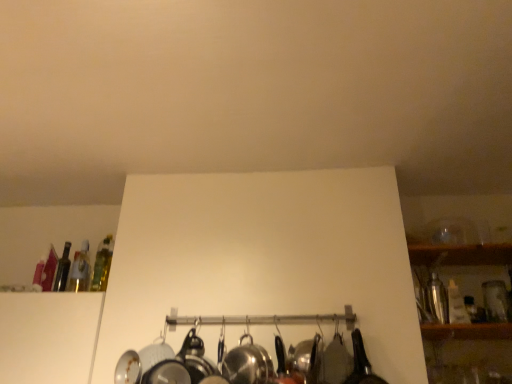
Where is `polished stainless steel wok at center`? The width and height of the screenshot is (512, 384). polished stainless steel wok at center is located at coordinates (247, 363).

How much space does translucent glass bottle at left, which appears as the 3th bottle when viewed from the left, occupy vertically?

It is 31.62 centimeters.

The height and width of the screenshot is (384, 512). Find the location of `polished stainless steel wok at center`. polished stainless steel wok at center is located at coordinates (247, 363).

Find the location of a particular element. The image size is (512, 384). the 2nd bottle below the translucent glass bottle at upper left, which is counted as the fourth bottle, starting from the right (from the image's perspective) is located at coordinates (437, 299).

Is translucent glass bottle at upper left, which is counted as the fourth bottle, starting from the right, completely or partially inside shiny metallic shaker at right, the 4th bottle from the left?

No, translucent glass bottle at upper left, which is counted as the fourth bottle, starting from the right, is not a part of shiny metallic shaker at right, the 4th bottle from the left.

How many degrees apart are the facing directions of shiny metallic shaker at right, arranged as the first bottle when viewed from the right, and translucent glass bottle at upper left, which is counted as the fourth bottle, starting from the right?

shiny metallic shaker at right, arranged as the first bottle when viewed from the right, and translucent glass bottle at upper left, which is counted as the fourth bottle, starting from the right, are facing 0.0034 degrees away from each other.

Is polished stainless steel wok at center directly adjacent to shiny metallic shaker at right, arranged as the first bottle when viewed from the right?

No, polished stainless steel wok at center is not making contact with shiny metallic shaker at right, arranged as the first bottle when viewed from the right.

Can you confirm if polished stainless steel wok at center is taller than shiny metallic shaker at right, arranged as the first bottle when viewed from the right?

No, polished stainless steel wok at center is not taller than shiny metallic shaker at right, arranged as the first bottle when viewed from the right.

Is polished stainless steel wok at center behind shiny metallic shaker at right, the 4th bottle from the left?

No, polished stainless steel wok at center is closer to the viewer.

Is translucent glass bottle at upper left, the third bottle in the right-to-left sequence, behind shiny metallic shaker at right, arranged as the first bottle when viewed from the right?

Yes, the depth of translucent glass bottle at upper left, the third bottle in the right-to-left sequence, is greater than that of shiny metallic shaker at right, arranged as the first bottle when viewed from the right.

Is shiny metallic shaker at right, the 4th bottle from the left, a part of translucent glass bottle at upper left, which is the 2th bottle in left-to-right order?

No, shiny metallic shaker at right, the 4th bottle from the left, is not inside translucent glass bottle at upper left, which is the 2th bottle in left-to-right order.

Can you confirm if translucent glass bottle at upper left, which is the 2th bottle in left-to-right order, is smaller than shiny metallic shaker at right, arranged as the first bottle when viewed from the right?

Correct, translucent glass bottle at upper left, which is the 2th bottle in left-to-right order, occupies less space than shiny metallic shaker at right, arranged as the first bottle when viewed from the right.

Is translucent glass bottle at upper left, arranged as the 1th bottle when viewed from the left, positioned behind shiny metallic shaker at right, the 4th bottle from the left?

Yes, translucent glass bottle at upper left, arranged as the 1th bottle when viewed from the left, is behind shiny metallic shaker at right, the 4th bottle from the left.

Where is `bottle that is the 1st object above the shiny metallic shaker at right, arranged as the first bottle when viewed from the right (from a real-world perspective)`? The height and width of the screenshot is (384, 512). bottle that is the 1st object above the shiny metallic shaker at right, arranged as the first bottle when viewed from the right (from a real-world perspective) is located at coordinates (62, 270).

Looking at this image, is shiny metallic shaker at right, arranged as the first bottle when viewed from the right, at the back of translucent glass bottle at upper left, arranged as the 1th bottle when viewed from the left?

translucent glass bottle at upper left, arranged as the 1th bottle when viewed from the left, does not have its back to shiny metallic shaker at right, arranged as the first bottle when viewed from the right.

Which of these two, translucent glass bottle at upper left, which is the 2th bottle in left-to-right order, or translucent glass bottle at upper left, which is counted as the fourth bottle, starting from the right, is smaller?

Smaller between the two is translucent glass bottle at upper left, which is the 2th bottle in left-to-right order.

Does translucent glass bottle at upper left, the third bottle in the right-to-left sequence, have a lesser height compared to translucent glass bottle at upper left, arranged as the 1th bottle when viewed from the left?

No.

From a real-world perspective, is translucent glass bottle at upper left, the third bottle in the right-to-left sequence, above or below translucent glass bottle at upper left, arranged as the 1th bottle when viewed from the left?

Clearly, from a real-world perspective, translucent glass bottle at upper left, the third bottle in the right-to-left sequence, is above translucent glass bottle at upper left, arranged as the 1th bottle when viewed from the left.

Are translucent glass bottle at upper left, arranged as the 1th bottle when viewed from the left, and translucent glass bottle at upper left, the third bottle in the right-to-left sequence, located far from each other?

No, translucent glass bottle at upper left, arranged as the 1th bottle when viewed from the left, is in close proximity to translucent glass bottle at upper left, the third bottle in the right-to-left sequence.

The height and width of the screenshot is (384, 512). I want to click on the 1st bottle in front when counting from the translucent glass bottle at upper left, the third bottle in the right-to-left sequence, so click(62, 270).

From the image's perspective, which one is positioned lower, translucent glass bottle at upper left, which is counted as the fourth bottle, starting from the right, or translucent glass bottle at upper left, which is the 2th bottle in left-to-right order?

translucent glass bottle at upper left, which is the 2th bottle in left-to-right order, appears lower in the image.

Is shiny metallic shaker at right, the 4th bottle from the left, to the left of translucent glass bottle at left, which appears as the 3th bottle when viewed from the left, from the viewer's perspective?

Incorrect, shiny metallic shaker at right, the 4th bottle from the left, is not on the left side of translucent glass bottle at left, which appears as the 3th bottle when viewed from the left.

Is shiny metallic shaker at right, the 4th bottle from the left, looking in the opposite direction of translucent glass bottle at left, which appears as the 3th bottle when viewed from the left?

shiny metallic shaker at right, the 4th bottle from the left, does not have its back to translucent glass bottle at left, which appears as the 3th bottle when viewed from the left.

Does point (434, 305) come behind point (104, 248)?

No.

Is translucent glass bottle at left, placed as the second bottle when sorted from right to left, located within shiny metallic shaker at right, arranged as the first bottle when viewed from the right?

Definitely not — translucent glass bottle at left, placed as the second bottle when sorted from right to left, is not inside shiny metallic shaker at right, arranged as the first bottle when viewed from the right.

Locate an element on the screen. The width and height of the screenshot is (512, 384). bottle that is the 3rd one when counting leftward from the shiny metallic shaker at right, arranged as the first bottle when viewed from the right is located at coordinates (62, 270).

Locate an element on the screen. The height and width of the screenshot is (384, 512). the 1st bottle above the polished stainless steel wok at center (from the image's perspective) is located at coordinates (437, 299).

From the image, which object appears to be farther from translucent glass bottle at upper left, which is counted as the fourth bottle, starting from the right, translucent glass bottle at upper left, the third bottle in the right-to-left sequence, or shiny metallic shaker at right, arranged as the first bottle when viewed from the right?

shiny metallic shaker at right, arranged as the first bottle when viewed from the right, lies further to translucent glass bottle at upper left, which is counted as the fourth bottle, starting from the right, than the other object.

Which object lies further to the anchor point translucent glass bottle at upper left, arranged as the 1th bottle when viewed from the left, translucent glass bottle at left, placed as the second bottle when sorted from right to left, or shiny metallic shaker at right, the 4th bottle from the left?

shiny metallic shaker at right, the 4th bottle from the left, is further to translucent glass bottle at upper left, arranged as the 1th bottle when viewed from the left.

Estimate the real-world distances between objects in this image. Which object is further from shiny metallic shaker at right, arranged as the first bottle when viewed from the right, polished stainless steel wok at center or translucent glass bottle at upper left, which is counted as the fourth bottle, starting from the right?

The object further to shiny metallic shaker at right, arranged as the first bottle when viewed from the right, is translucent glass bottle at upper left, which is counted as the fourth bottle, starting from the right.

Based on their spatial positions, is shiny metallic shaker at right, the 4th bottle from the left, or translucent glass bottle at upper left, arranged as the 1th bottle when viewed from the left, closer to translucent glass bottle at upper left, which is the 2th bottle in left-to-right order?

translucent glass bottle at upper left, arranged as the 1th bottle when viewed from the left, is closer to translucent glass bottle at upper left, which is the 2th bottle in left-to-right order.

Looking at the image, which one is located further to shiny metallic shaker at right, the 4th bottle from the left, translucent glass bottle at upper left, which is counted as the fourth bottle, starting from the right, or polished stainless steel wok at center?

Among the two, translucent glass bottle at upper left, which is counted as the fourth bottle, starting from the right, is located further to shiny metallic shaker at right, the 4th bottle from the left.

Looking at the image, which one is located further to polished stainless steel wok at center, translucent glass bottle at left, placed as the second bottle when sorted from right to left, or translucent glass bottle at upper left, which is the 2th bottle in left-to-right order?

translucent glass bottle at upper left, which is the 2th bottle in left-to-right order.

Which object lies further to the anchor point translucent glass bottle at upper left, the third bottle in the right-to-left sequence, translucent glass bottle at upper left, arranged as the 1th bottle when viewed from the left, or polished stainless steel wok at center?

polished stainless steel wok at center is positioned further to the anchor translucent glass bottle at upper left, the third bottle in the right-to-left sequence.

From the image, which object appears to be nearer to translucent glass bottle at left, which appears as the 3th bottle when viewed from the left, translucent glass bottle at upper left, arranged as the 1th bottle when viewed from the left, or polished stainless steel wok at center?

translucent glass bottle at upper left, arranged as the 1th bottle when viewed from the left, is closer to translucent glass bottle at left, which appears as the 3th bottle when viewed from the left.

The width and height of the screenshot is (512, 384). Identify the location of wok between translucent glass bottle at upper left, which is counted as the fourth bottle, starting from the right, and shiny metallic shaker at right, the 4th bottle from the left. (247, 363).

Locate an element on the screen. This screenshot has height=384, width=512. wok located between translucent glass bottle at left, placed as the second bottle when sorted from right to left, and shiny metallic shaker at right, the 4th bottle from the left, in the left-right direction is located at coordinates (247, 363).

This screenshot has height=384, width=512. I want to click on bottle situated between translucent glass bottle at upper left, the third bottle in the right-to-left sequence, and polished stainless steel wok at center from left to right, so click(x=102, y=265).

The image size is (512, 384). I want to click on bottle situated between translucent glass bottle at upper left, which is counted as the fourth bottle, starting from the right, and translucent glass bottle at left, which appears as the 3th bottle when viewed from the left, from left to right, so click(80, 270).